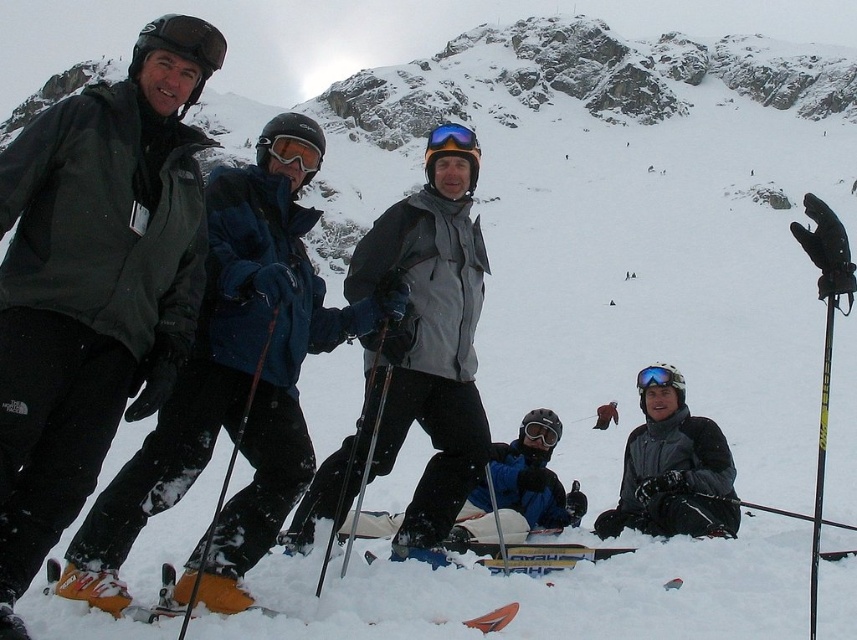
You are a photographer trying to capture a clear shot of the blue reflective lens goggles at center and the orange plastic ski at lower left. Which object should you focus on first if you want to ensure both are in focus without adjusting your camera settings?

The orange plastic ski at lower left is closer to the viewer than the blue reflective lens goggles at center. To ensure both are in focus, you should focus on the orange plastic ski at lower left first since it is closer, and the depth of field may naturally include the farther object if focused on the nearer one.

You are a photographer trying to capture the yellow matte ski at center in your shot. Based on its coordinates, where should you position your camera to ensure it is centered in the frame?

The yellow matte ski at center is already positioned at the coordinates provided, so centering your camera on those coordinates would ensure the ski is centered in the frame.